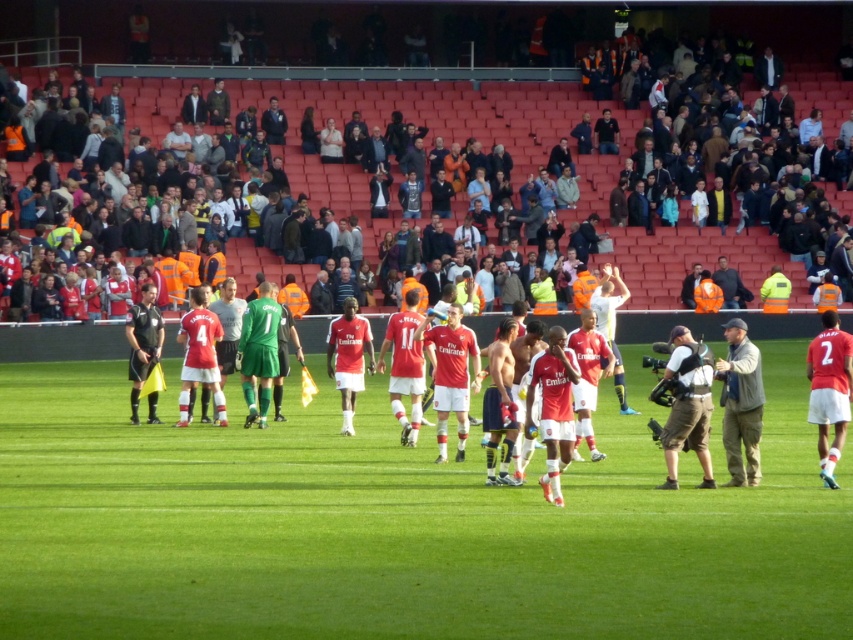
Question: Which object appears farthest from the camera in this image?

Choices:
 (A) green grass field at center
 (B) gray fabric jacket at right
 (C) dark blue suit at upper center
 (D) camouflage-patterned vest at center-right

Answer: (C)

Question: Which point is farther from the camera taking this photo?

Choices:
 (A) (288, 452)
 (B) (755, 429)

Answer: (A)

Question: Is camouflage-patterned vest at center-right to the left of dark blue suit at upper center from the viewer's perspective?

Choices:
 (A) yes
 (B) no

Answer: (B)

Question: Which point is farther to the camera?

Choices:
 (A) dark blue suit at upper center
 (B) green grass field at center
 (C) gray fabric jacket at right

Answer: (A)

Question: Does camouflage-patterned vest at center-right have a smaller size compared to dark blue suit at upper center?

Choices:
 (A) yes
 (B) no

Answer: (B)

Question: Is gray fabric jacket at right in front of dark blue suit at upper center?

Choices:
 (A) yes
 (B) no

Answer: (A)